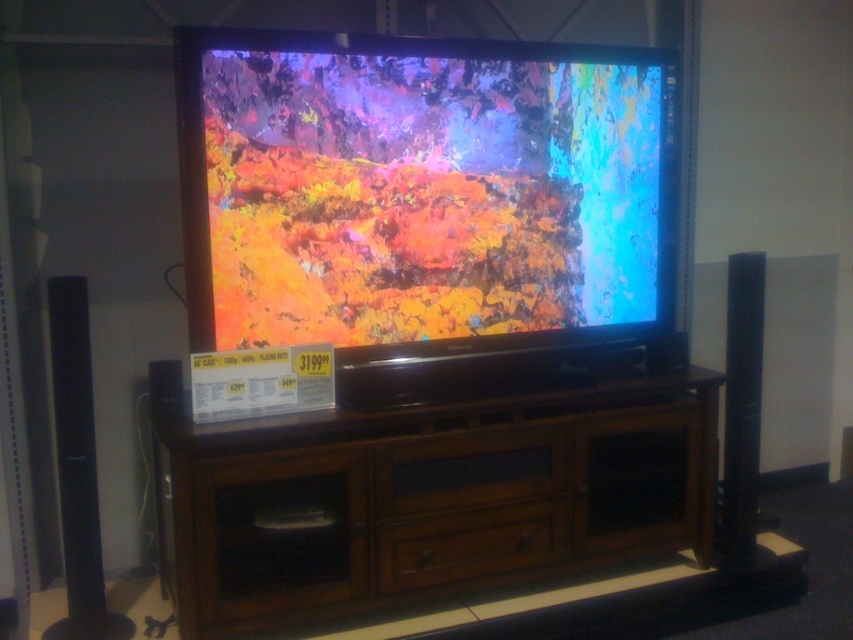
Question: Does black glossy speaker at left appear under black glossy speaker at right?

Choices:
 (A) no
 (B) yes

Answer: (B)

Question: Does matte plastic television at center appear on the left side of black glossy speaker at left?

Choices:
 (A) yes
 (B) no

Answer: (B)

Question: Does brown wood entertainment center at center have a smaller size compared to black glossy speaker at right?

Choices:
 (A) yes
 (B) no

Answer: (B)

Question: Which of the following is the closest to the observer?

Choices:
 (A) (64, 452)
 (B) (460, 570)

Answer: (A)

Question: Which object is closer to the camera taking this photo?

Choices:
 (A) black glossy speaker at right
 (B) matte plastic television at center

Answer: (B)

Question: Among these points, which one is farthest from the camera?

Choices:
 (A) (756, 266)
 (B) (422, 486)
 (C) (584, 308)
 (D) (57, 445)

Answer: (C)